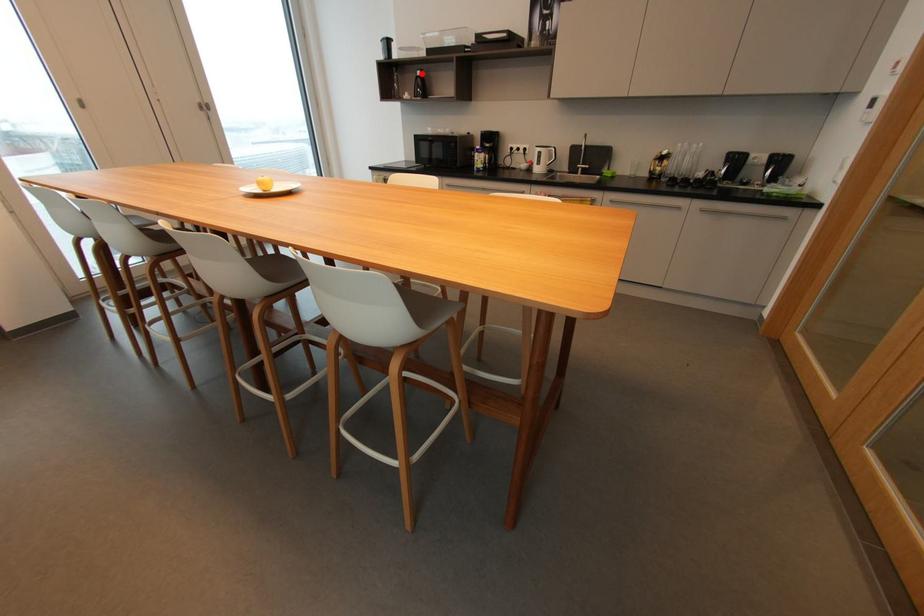
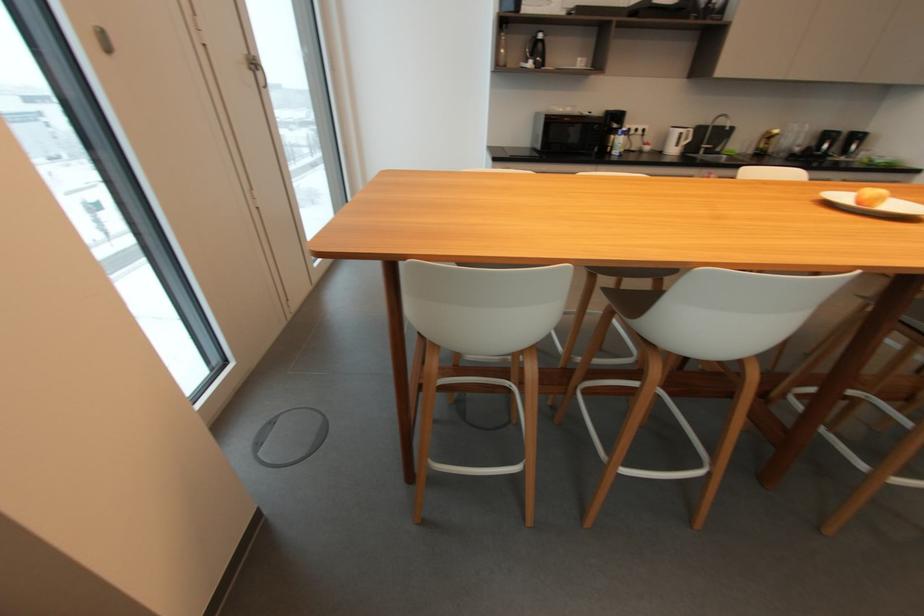
Question: I am providing you with two images of the same scene from different viewpoints. A red point is marked on the first image. Can you still see the location of the red point in image 2?

Choices:
 (A) Yes
 (B) No

Answer: (A)